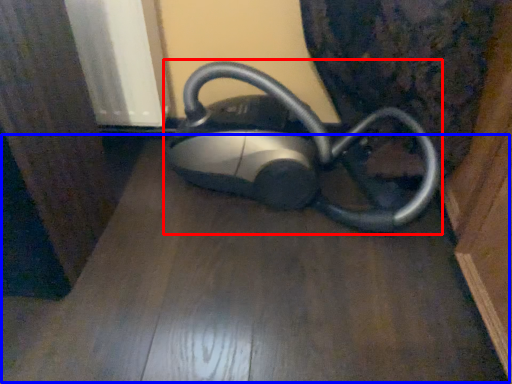
Question: Which of the following is the farthest to the observer, home appliance (highlighted by a red box) or surface (highlighted by a blue box)?

Choices:
 (A) home appliance
 (B) surface

Answer: (A)